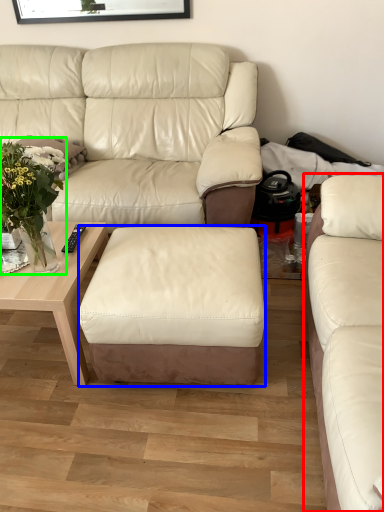
Question: Which is farther away from studio couch (highlighted by a red box)? stool (highlighted by a blue box) or floral arrangement (highlighted by a green box)?

Choices:
 (A) stool
 (B) floral arrangement

Answer: (B)